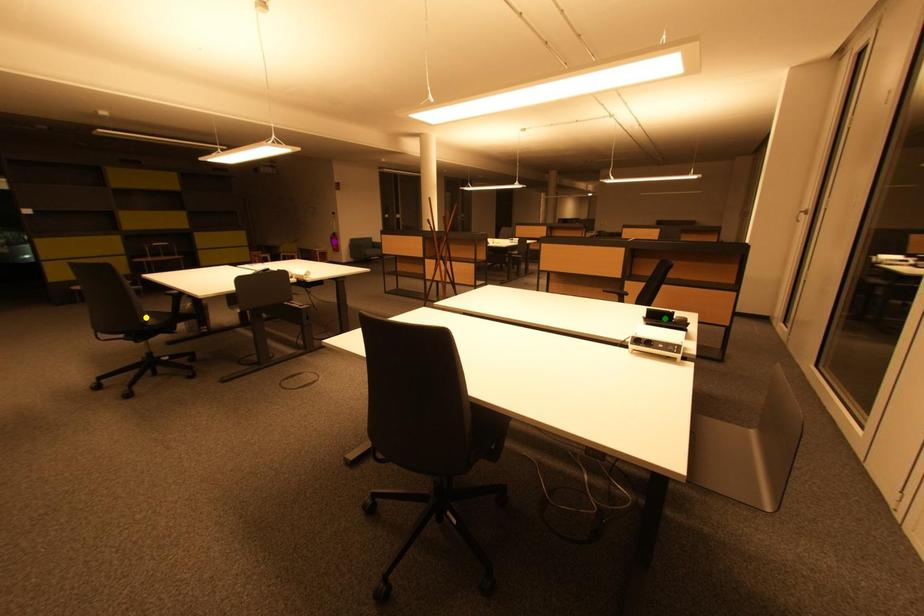
Order these from nearest to farthest:
A) purple point
B) yellow point
C) green point

green point, yellow point, purple point